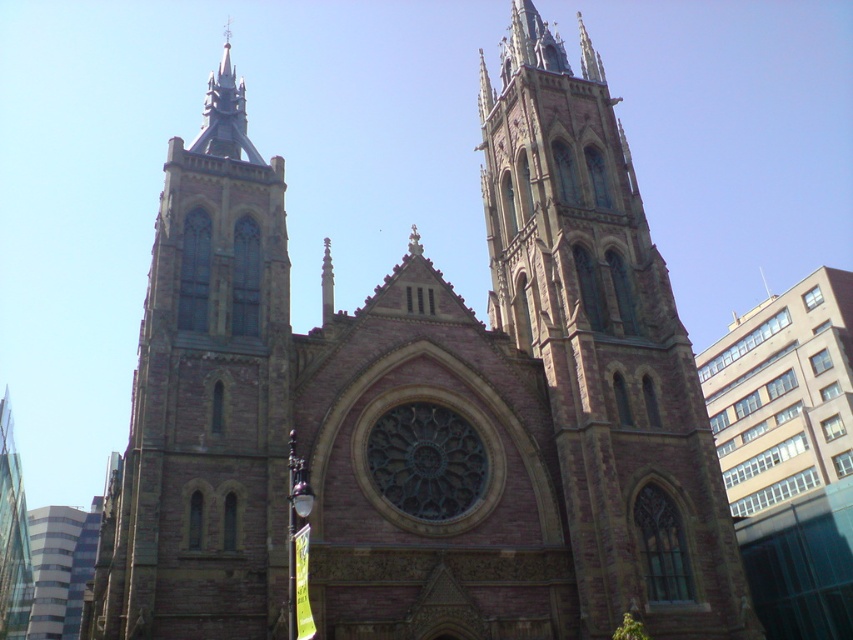
Question: Which object is farther from the camera taking this photo?

Choices:
 (A) brown stone tower at left
 (B) brown stone tower at center
 (C) transparent glass tower at left

Answer: (C)

Question: Among these objects, which one is farthest from the camera?

Choices:
 (A) brown stone tower at center
 (B) brown stone tower at left

Answer: (A)

Question: Can you confirm if brown stone tower at center is bigger than brown stone tower at left?

Choices:
 (A) no
 (B) yes

Answer: (A)

Question: Can you confirm if brown stone tower at center is smaller than transparent glass tower at left?

Choices:
 (A) no
 (B) yes

Answer: (B)

Question: Which object is closer to the camera taking this photo?

Choices:
 (A) brown stone tower at left
 (B) transparent glass tower at left
 (C) brown stone tower at center

Answer: (A)

Question: Where is brown stone tower at left located in relation to transparent glass tower at left in the image?

Choices:
 (A) left
 (B) right

Answer: (B)